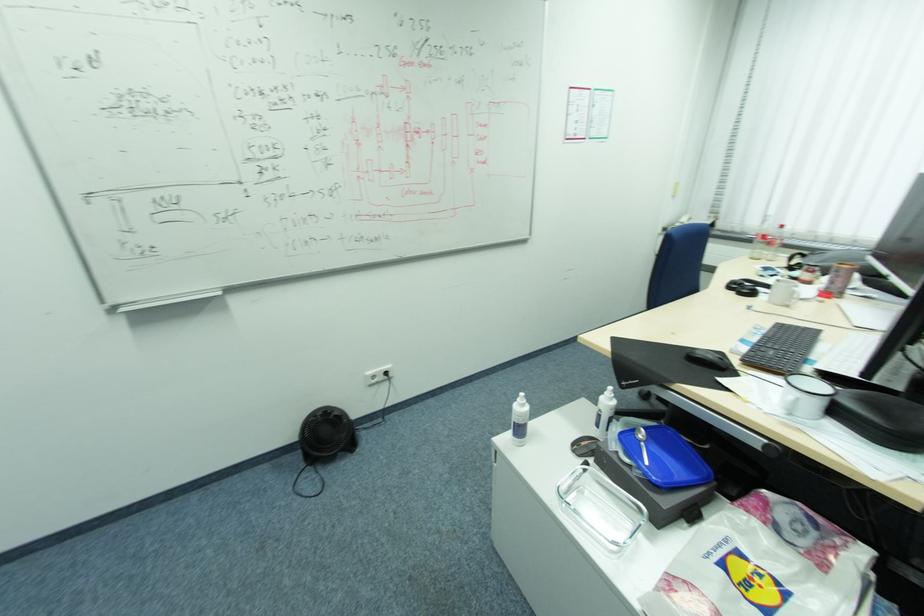
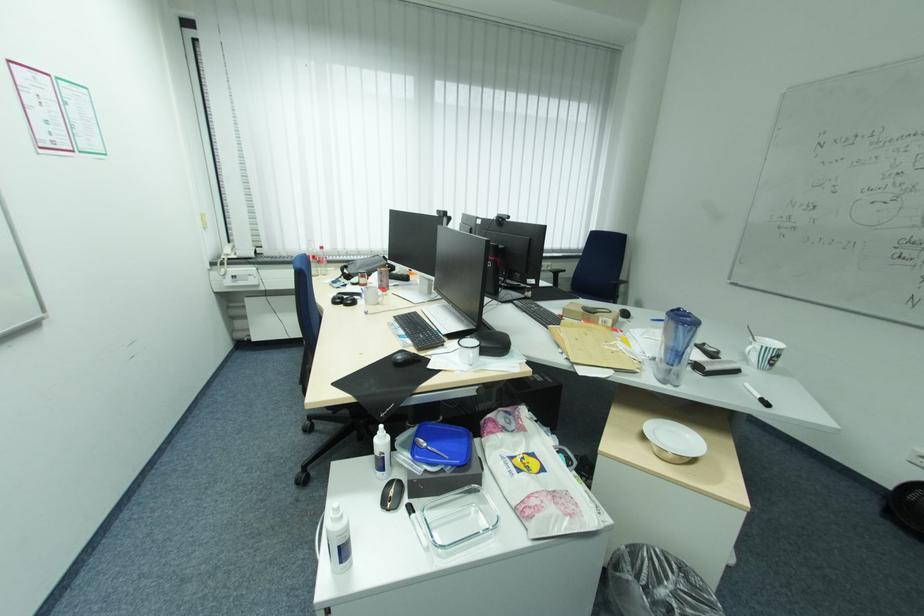
Locate, in the second image, the point that corresponds to point 738,293 in the first image.

(348, 305)